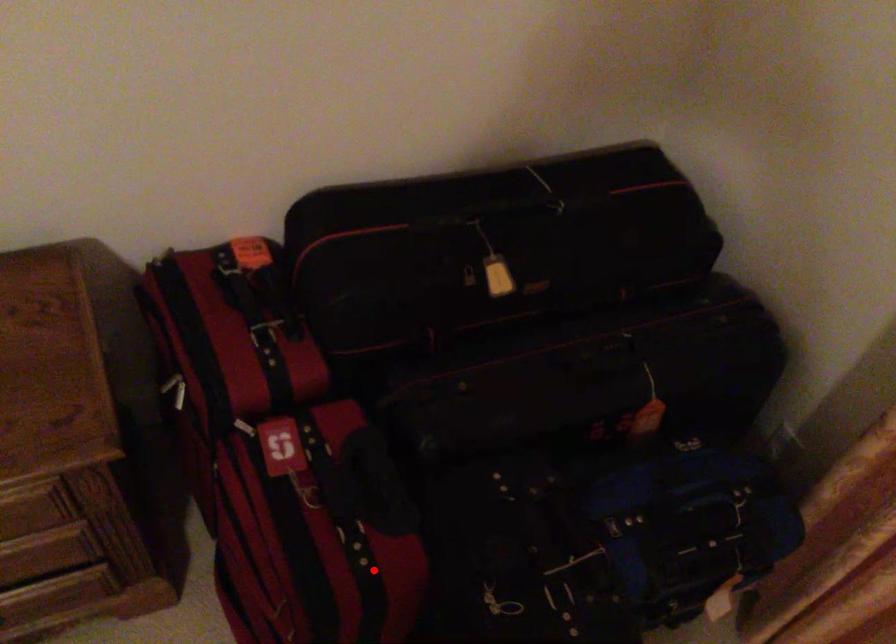
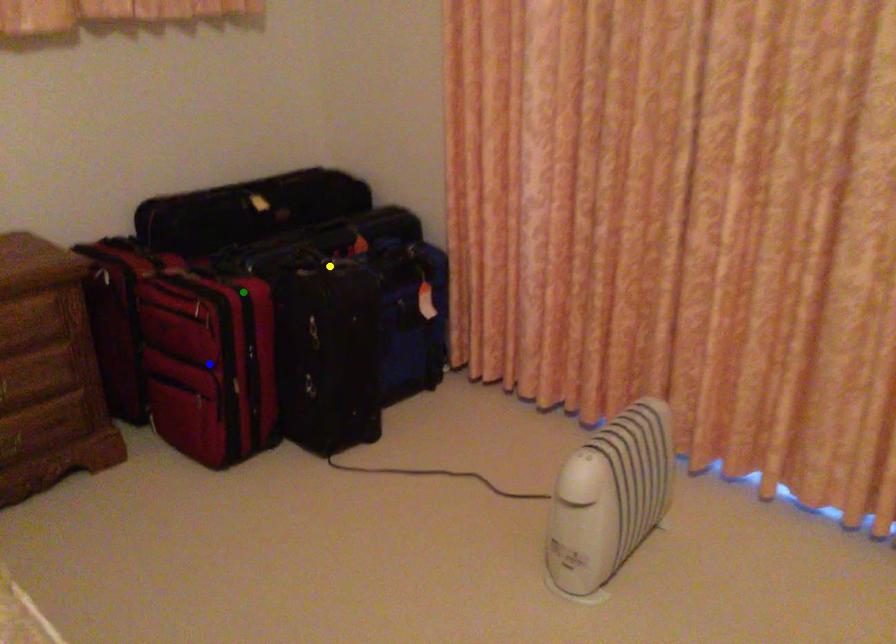
Question: I am providing you with two images of the same scene from different viewpoints. A red point is marked on the first image. You are given multiple points on the second image. Which point in image 2 represents the same 3d spot as the red point in image 1?

Choices:
 (A) yellow point
 (B) green point
 (C) blue point

Answer: (B)